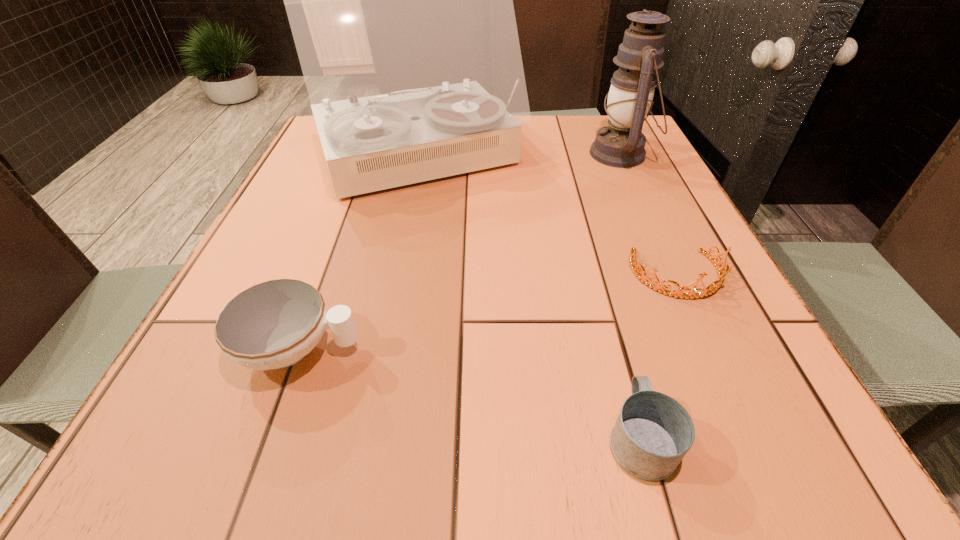
Find the location of a particular element. The image size is (960, 540). vacant space located 0.320m on the side of the nearest object with the handle is located at coordinates (590, 255).

This screenshot has height=540, width=960. I want to click on free space located on the side of the nearest object with the handle, so click(604, 303).

Locate an element on the screen. free space located on the side of the nearest object with the handle is located at coordinates (604, 303).

Where is `record player at the far edge`? This screenshot has height=540, width=960. record player at the far edge is located at coordinates (400, 0).

Locate an element on the screen. oil lamp present at the far edge is located at coordinates (621, 144).

Locate an element on the screen. This screenshot has height=540, width=960. object situated at the near edge is located at coordinates (653, 432).

Identify the location of record player that is at the left edge. (400, 0).

At what (x,y) coordinates should I click in order to perform the action: click on chinaware present at the left edge. Please return your answer as a coordinate pair (x, y). Image resolution: width=960 pixels, height=540 pixels. Looking at the image, I should click on [x=274, y=324].

Identify the location of oil lamp that is at the right edge. (621, 144).

This screenshot has width=960, height=540. I want to click on tiara that is positioned at the right edge, so click(722, 272).